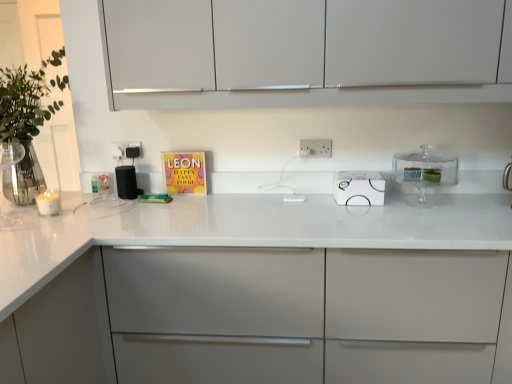
Question: Looking at their shapes, would you say white plastic electric outlet at center, the 2th electric outlet when ordered from right to left, is wider or thinner than white glossy electric stove at center?

Choices:
 (A) wide
 (B) thin

Answer: (B)

Question: Is white plastic electric outlet at center, the 2th electric outlet when ordered from right to left, situated inside white glossy electric stove at center or outside?

Choices:
 (A) outside
 (B) inside

Answer: (A)

Question: Which object is positioned farthest from the white matte cabinet at upper center, arranged as the first cabinetry when viewed from the top?

Choices:
 (A) white glossy electric stove at center
 (B) clear glass cake stand at right
 (C) white matte cabinet at center, marked as the 1th cabinetry in a bottom-to-top arrangement
 (D) green leafy plant at left
 (E) matte colorful book at center

Answer: (D)

Question: Which object is the closest to the white glossy electric stove at center?

Choices:
 (A) clear glass cake stand at right
 (B) matte colorful book at center
 (C) white plastic electric outlet at center, the 1th electric outlet when ordered from right to left
 (D) green leafy plant at left
 (E) white plastic electric outlet at center, which is the first electric outlet in left-to-right order

Answer: (A)